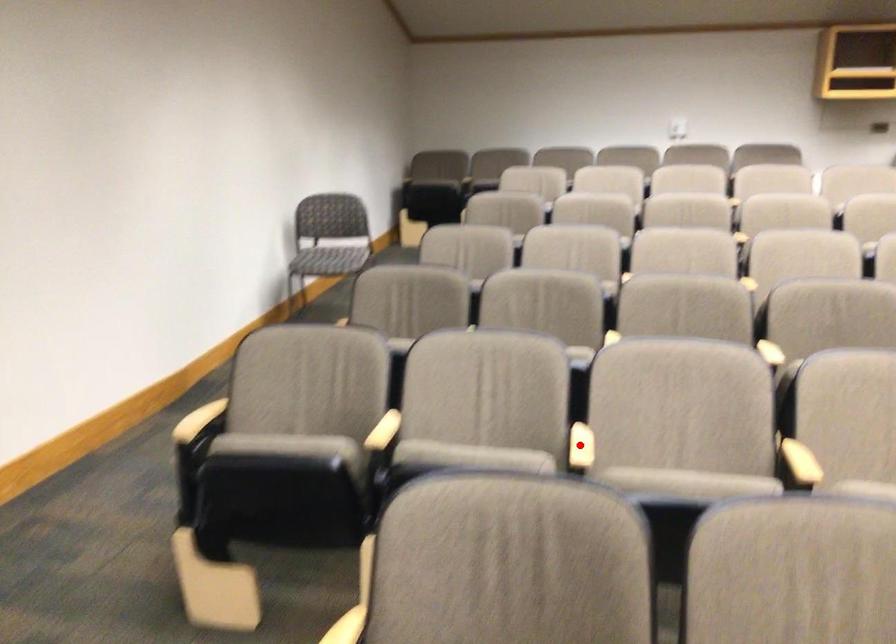
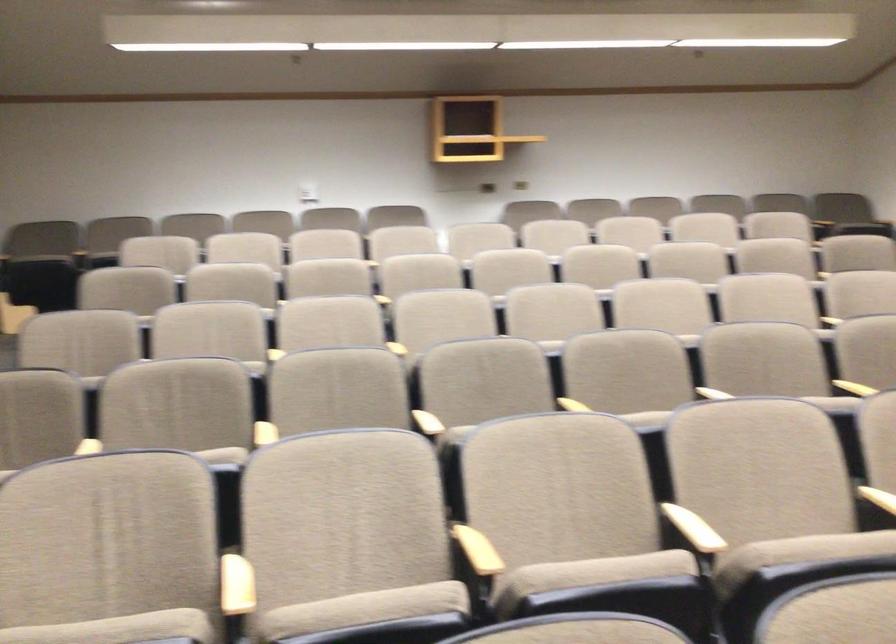
The point at the highlighted location is marked in the first image. Where is the corresponding point in the second image?

(236, 585)